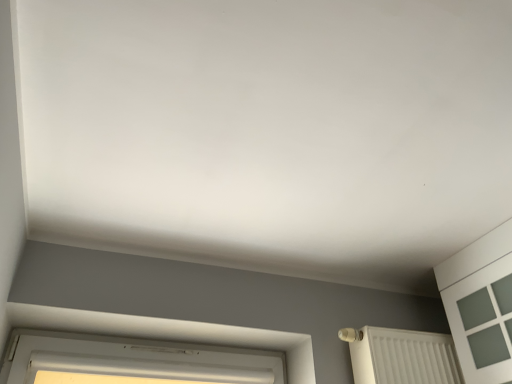
What do you see at coordinates (403, 357) in the screenshot? I see `white textured radiator at lower right` at bounding box center [403, 357].

Measure the distance between white textured radiator at lower right and camera.

They are 1.63 meters apart.

Image resolution: width=512 pixels, height=384 pixels. I want to click on white textured radiator at lower right, so click(x=403, y=357).

Where is `white plastic window at lower left`? white plastic window at lower left is located at coordinates (132, 361).

The height and width of the screenshot is (384, 512). Describe the element at coordinates (132, 361) in the screenshot. I see `white plastic window at lower left` at that location.

Where is `white textured radiator at lower right`? The image size is (512, 384). white textured radiator at lower right is located at coordinates (403, 357).

Visually, is white textured radiator at lower right positioned to the left or to the right of white plastic window at lower left?

white textured radiator at lower right is positioned on white plastic window at lower left's right side.

Between white textured radiator at lower right and white plastic window at lower left, which one is positioned behind?

white textured radiator at lower right.

Does point (388, 353) come closer to viewer compared to point (3, 368)?

No, it is behind (3, 368).

Based on the photo, from the image's perspective, is white textured radiator at lower right positioned above or below white plastic window at lower left?

From the image's perspective, white textured radiator at lower right appears above white plastic window at lower left.

From a real-world perspective, is white textured radiator at lower right under white plastic window at lower left?

No, from a real-world perspective, white textured radiator at lower right is not beneath white plastic window at lower left.

Which of these two, white textured radiator at lower right or white plastic window at lower left, is wider?

white textured radiator at lower right.

Considering the relative sizes of white textured radiator at lower right and white plastic window at lower left in the image provided, is white textured radiator at lower right shorter than white plastic window at lower left?

Incorrect, the height of white textured radiator at lower right does not fall short of that of white plastic window at lower left.

Considering the sizes of objects white textured radiator at lower right and white plastic window at lower left in the image provided, who is bigger, white textured radiator at lower right or white plastic window at lower left?

Bigger between the two is white textured radiator at lower right.

Is white textured radiator at lower right located outside white plastic window at lower left?

That's correct, white textured radiator at lower right is outside of white plastic window at lower left.

Are white textured radiator at lower right and white plastic window at lower left far apart?

Actually, white textured radiator at lower right and white plastic window at lower left are a little close together.

Is white textured radiator at lower right oriented away from white plastic window at lower left?

No, white textured radiator at lower right is not facing the opposite direction of white plastic window at lower left.

In the scene shown: What's the angular difference between white textured radiator at lower right and white plastic window at lower left's facing directions?

white textured radiator at lower right and white plastic window at lower left are facing 1.69 degrees away from each other.

How distant is white textured radiator at lower right from white plastic window at lower left?

white textured radiator at lower right is 66.56 centimeters away from white plastic window at lower left.

In order to click on radiator to the right of white plastic window at lower left in this screenshot , I will do `click(403, 357)`.

Considering the relative positions of white plastic window at lower left and white textured radiator at lower right in the image provided, is white plastic window at lower left to the left of white textured radiator at lower right from the viewer's perspective?

Yes.

Between white plastic window at lower left and white textured radiator at lower right, which one is positioned behind?

white textured radiator at lower right is behind.

Between point (182, 373) and point (450, 353), which one is positioned behind?

The point (450, 353) is farther.

From the image's perspective, which one is positioned higher, white plastic window at lower left or white textured radiator at lower right?

white textured radiator at lower right.

From a real-world perspective, is white plastic window at lower left positioned above or below white textured radiator at lower right?

From a real-world perspective, white plastic window at lower left is physically below white textured radiator at lower right.

In the scene shown: Is white plastic window at lower left thinner than white textured radiator at lower right?

Yes.

Considering the relative sizes of white plastic window at lower left and white textured radiator at lower right in the image provided, is white plastic window at lower left taller than white textured radiator at lower right?

No, white plastic window at lower left is not taller than white textured radiator at lower right.

Between white plastic window at lower left and white textured radiator at lower right, which one has larger size?

Bigger between the two is white textured radiator at lower right.

Is white textured radiator at lower right surrounded by white plastic window at lower left?

No, white textured radiator at lower right is not surrounded by white plastic window at lower left.

In the scene shown: Are white plastic window at lower left and white textured radiator at lower right located far from each other?

Actually, white plastic window at lower left and white textured radiator at lower right are a little close together.

Is white plastic window at lower left aimed at white textured radiator at lower right?

No, white plastic window at lower left does not turn towards white textured radiator at lower right.

I want to click on radiator positioned vertically above the white plastic window at lower left (from a real-world perspective), so point(403,357).

Locate an element on the screen. The image size is (512, 384). radiator that appears above the white plastic window at lower left (from a real-world perspective) is located at coordinates (403, 357).

Locate an element on the screen. This screenshot has width=512, height=384. radiator above the white plastic window at lower left (from the image's perspective) is located at coordinates (403, 357).